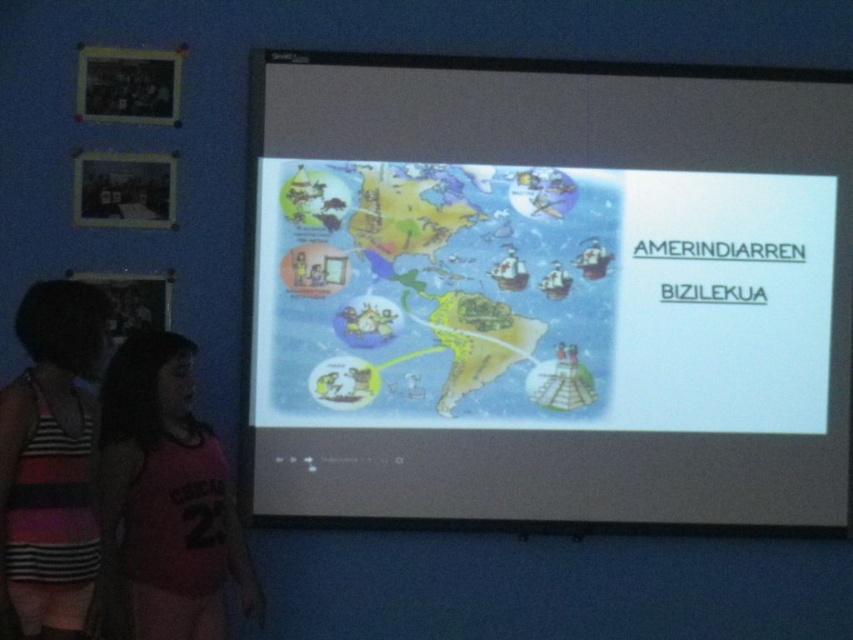
Question: Estimate the real-world distances between objects in this image. Which object is closer to the white matte projection screen at center?

Choices:
 (A) striped fabric tank top at lower left
 (B) pink jersey at lower left

Answer: (B)

Question: Can you confirm if white matte projection screen at center is wider than pink jersey at lower left?

Choices:
 (A) yes
 (B) no

Answer: (A)

Question: Which point is closer to the camera?

Choices:
 (A) (560, 88)
 (B) (245, 579)
 (C) (82, 288)

Answer: (C)

Question: Where is pink jersey at lower left located in relation to striped fabric tank top at lower left in the image?

Choices:
 (A) above
 (B) below

Answer: (B)

Question: Among these objects, which one is farthest from the camera?

Choices:
 (A) pink jersey at lower left
 (B) white matte projection screen at center

Answer: (B)

Question: Where is pink jersey at lower left located in relation to striped fabric tank top at lower left in the image?

Choices:
 (A) above
 (B) below

Answer: (B)